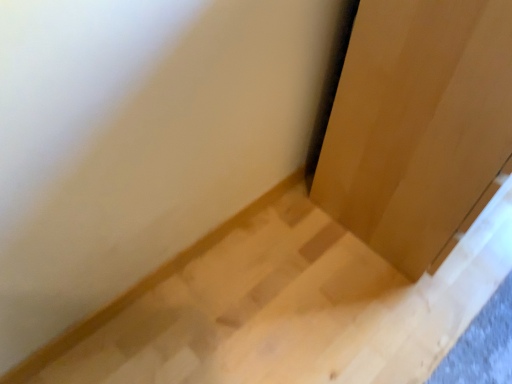
Where is `free space in front of matte wood door at right`? free space in front of matte wood door at right is located at coordinates (404, 308).